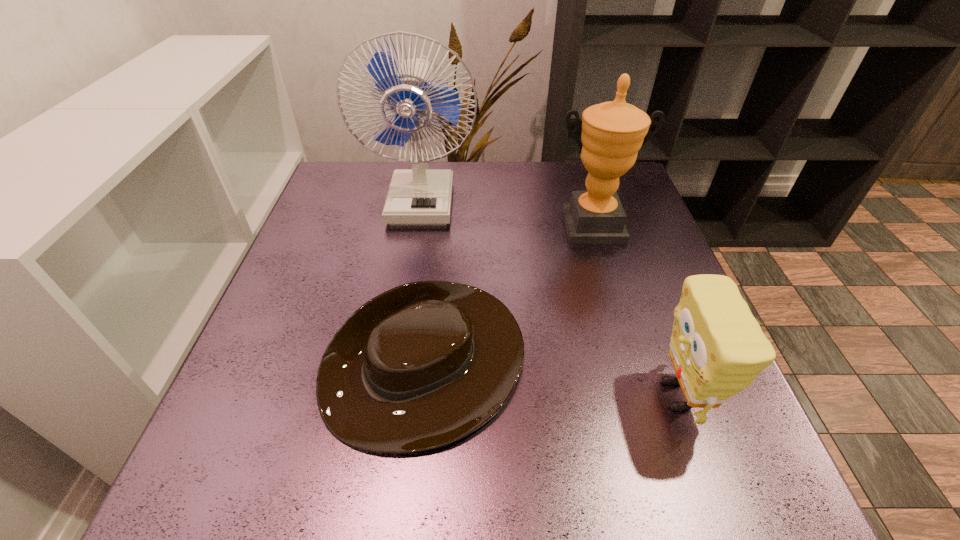
The width and height of the screenshot is (960, 540). I want to click on free space at the left edge of the desktop, so click(x=262, y=427).

In the image, there is a desktop. Where is `vacant space at the right edge`? vacant space at the right edge is located at coordinates [646, 213].

Find the location of `vacant space at the near left corner`. vacant space at the near left corner is located at coordinates (209, 498).

Where is `vacant space at the far right corner of the desktop`? This screenshot has width=960, height=540. vacant space at the far right corner of the desktop is located at coordinates (585, 171).

The height and width of the screenshot is (540, 960). Find the location of `vacant area that lies between the fan and the third shortest object`. vacant area that lies between the fan and the third shortest object is located at coordinates (507, 213).

At what (x,y) coordinates should I click in order to perform the action: click on free spot between the award and the sponge. Please return your answer as a coordinate pair (x, y). Looking at the image, I should click on (635, 311).

You are a GUI agent. You are given a task and a screenshot of the screen. Output one action in this format:
    pyautogui.click(x=<x>, y=<y>)
    Task: Click on the free space between the cowboy hat and the second tallest object
    The image size is (960, 540).
    Given the screenshot: What is the action you would take?
    click(x=509, y=296)

The width and height of the screenshot is (960, 540). Identify the location of free space that is in between the fan and the third shortest object. (507, 213).

This screenshot has width=960, height=540. I want to click on unoccupied position between the sponge and the third shortest object, so click(x=635, y=311).

This screenshot has height=540, width=960. I want to click on free space that is in between the award and the second shortest object, so click(635, 311).